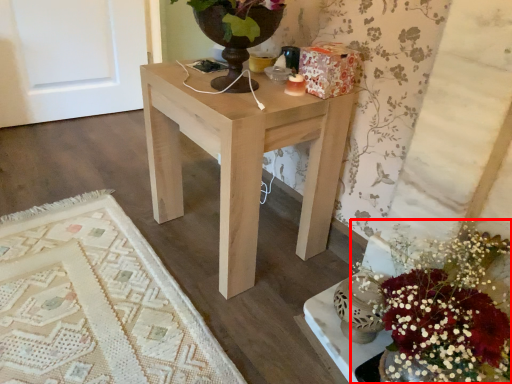
Question: In this image, where is flower (annotated by the red box) located relative to table?

Choices:
 (A) left
 (B) right

Answer: (B)